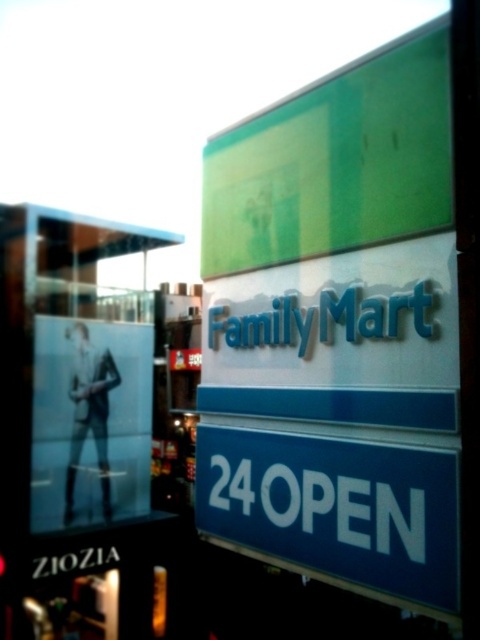
Can you confirm if transparent glass window at upper left is positioned below blue glossy sign at center?

Yes, transparent glass window at upper left is below blue glossy sign at center.

Between transparent glass window at upper left and blue glossy sign at center, which one is positioned higher?

blue glossy sign at center

What do you see at coordinates (81, 436) in the screenshot?
I see `transparent glass window at upper left` at bounding box center [81, 436].

Locate an element on the screen. This screenshot has height=640, width=480. transparent glass window at upper left is located at coordinates (81, 436).